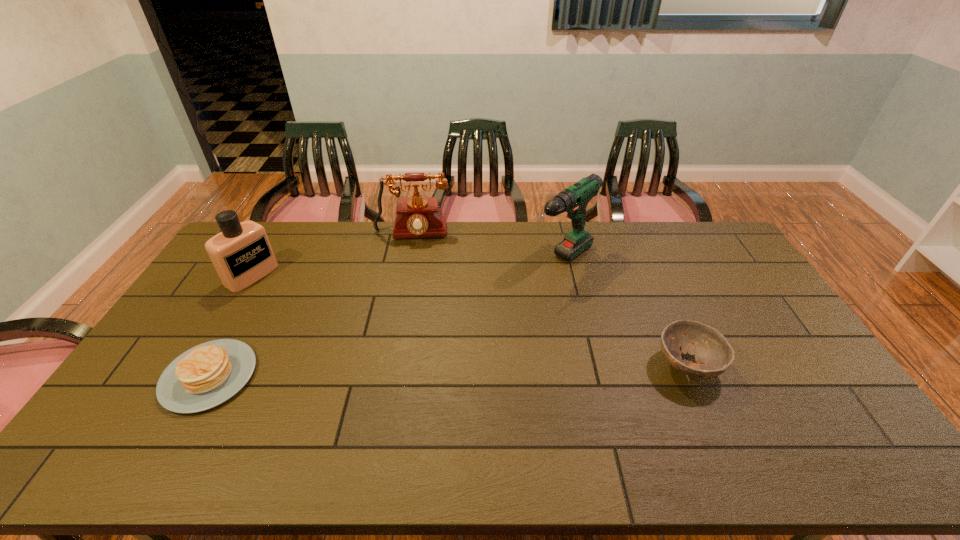
Find the location of a particular element. This screenshot has width=960, height=540. the shortest object is located at coordinates (205, 376).

You are a GUI agent. You are given a task and a screenshot of the screen. Output one action in this format:
    pyautogui.click(x=<x>, y=<y>)
    Task: Click on the bowl
    The image size is (960, 540).
    Given the screenshot: What is the action you would take?
    pyautogui.click(x=713, y=354)

Find the location of a particular element. The width and height of the screenshot is (960, 540). the rightmost object is located at coordinates tap(713, 354).

Image resolution: width=960 pixels, height=540 pixels. I want to click on perfume, so click(241, 253).

I want to click on the second object from right to left, so click(x=574, y=199).

Image resolution: width=960 pixels, height=540 pixels. I want to click on drill, so click(x=574, y=199).

In order to click on telephone in this screenshot , I will do `click(417, 217)`.

The image size is (960, 540). In order to click on vacant area located on the right of the pancake in this screenshot , I will do `click(308, 376)`.

This screenshot has height=540, width=960. Identify the location of free location located 0.290m on the left of the second shortest object. (553, 365).

Find the location of a particular element. The height and width of the screenshot is (540, 960). vacant space located on the front label of the perfume is located at coordinates (274, 291).